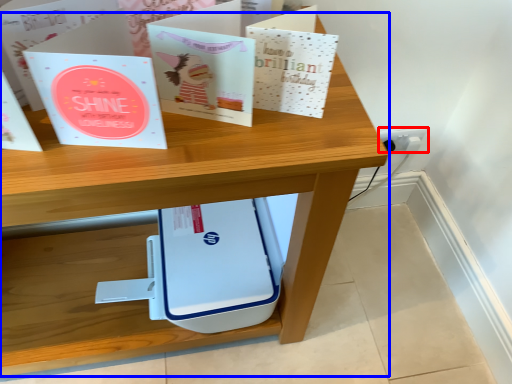
Question: Which of the following is the farthest to the observer, electric outlet (highlighted by a red box) or desk (highlighted by a blue box)?

Choices:
 (A) electric outlet
 (B) desk

Answer: (A)